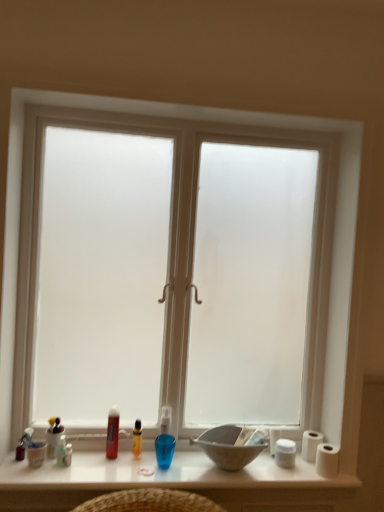
This screenshot has width=384, height=512. I want to click on vacant space to the right of matte white cup at lower left, the 4th toiletry viewed from the right, so click(97, 465).